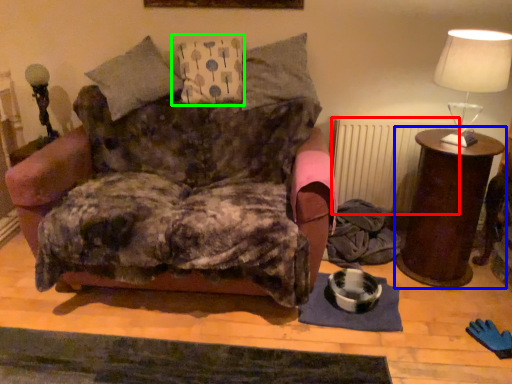
Question: Based on their relative distances, which object is nearer to radiator (highlighted by a red box)? Choose from nightstand (highlighted by a blue box) and pillow (highlighted by a green box).

Choices:
 (A) nightstand
 (B) pillow

Answer: (A)